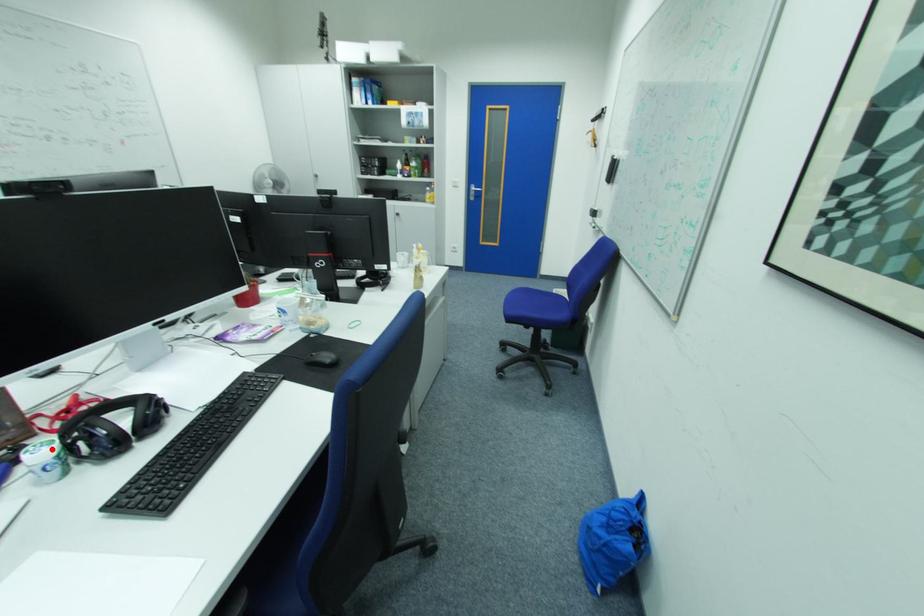
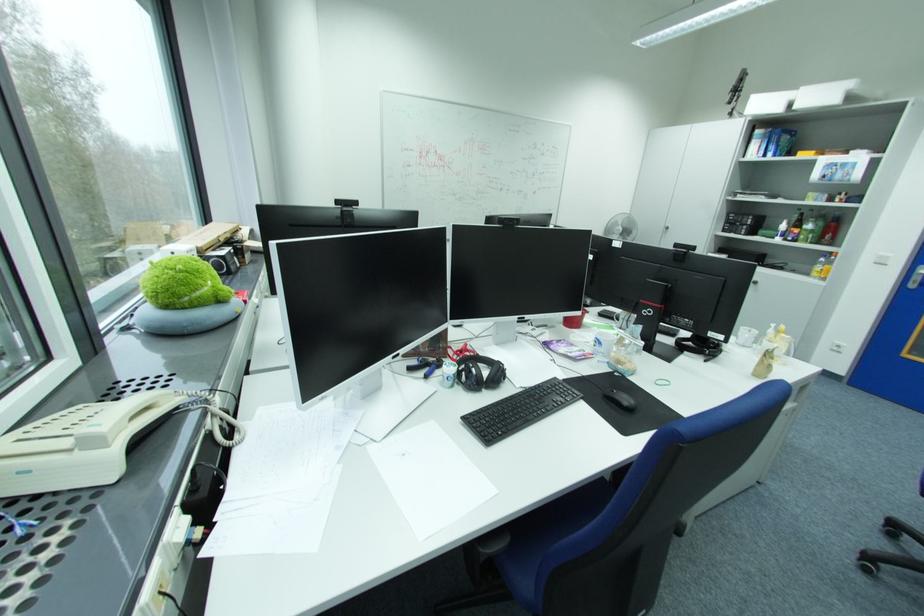
Locate, in the second image, the point that corresponds to the highlighted location in the first image.

(460, 367)